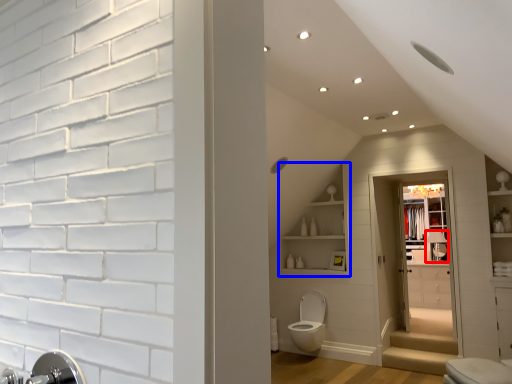
Question: Which of the following is the closest to the observer, faucet (highlighted by a red box) or shelf (highlighted by a blue box)?

Choices:
 (A) faucet
 (B) shelf

Answer: (B)